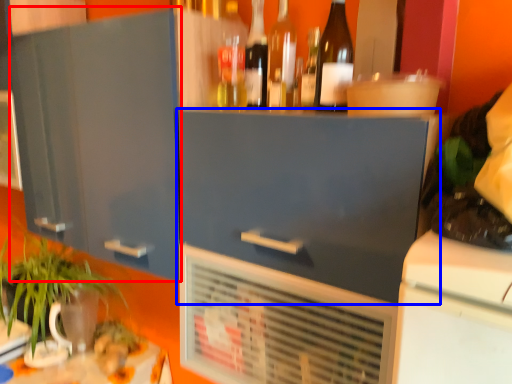
Question: Which object is closer to the camera taking this photo, cabinetry (highlighted by a red box) or cabinetry (highlighted by a blue box)?

Choices:
 (A) cabinetry
 (B) cabinetry

Answer: (B)